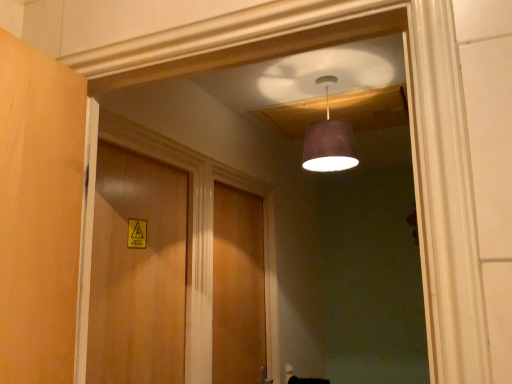
Question: Is wooden door at center, the 1th door viewed from the right, further to the viewer compared to wooden door at center, the 2th door in the right-to-left sequence?

Choices:
 (A) yes
 (B) no

Answer: (A)

Question: Does wooden door at center, which appears as the second door when viewed from the left, have a lesser height compared to wooden door at center, which is the 1th door in front-to-back order?

Choices:
 (A) no
 (B) yes

Answer: (A)

Question: From a real-world perspective, is wooden door at center, acting as the 1th door starting from the back, below wooden door at center, the 2th door from the back?

Choices:
 (A) no
 (B) yes

Answer: (B)

Question: From the image's perspective, does wooden door at center, which appears as the second door when viewed from the left, appear lower than wooden door at center, the first door from the left?

Choices:
 (A) no
 (B) yes

Answer: (B)

Question: Considering the relative positions of wooden door at center, the 2th door in the front-to-back sequence, and wooden door at center, the first door from the left, in the image provided, is wooden door at center, the 2th door in the front-to-back sequence, to the right of wooden door at center, the first door from the left, from the viewer's perspective?

Choices:
 (A) no
 (B) yes

Answer: (B)

Question: Is wooden door at center, which appears as the second door when viewed from the left, surrounding wooden door at center, the 2th door from the back?

Choices:
 (A) yes
 (B) no

Answer: (B)

Question: Can you confirm if wooden door at center, the 2th door in the right-to-left sequence, is shorter than wooden door at center, which appears as the second door when viewed from the left?

Choices:
 (A) yes
 (B) no

Answer: (A)

Question: Is wooden door at center, the 2th door from the back, turned away from wooden door at center, the 2th door in the front-to-back sequence?

Choices:
 (A) yes
 (B) no

Answer: (B)

Question: From a real-world perspective, is wooden door at center, the 2th door from the back, located beneath wooden door at center, acting as the 1th door starting from the back?

Choices:
 (A) no
 (B) yes

Answer: (A)

Question: Is wooden door at center, the first door from the left, positioned in front of wooden door at center, acting as the 1th door starting from the back?

Choices:
 (A) no
 (B) yes

Answer: (B)

Question: Is wooden door at center, the first door from the left, to the right of wooden door at center, the 2th door in the front-to-back sequence, from the viewer's perspective?

Choices:
 (A) yes
 (B) no

Answer: (B)

Question: Is wooden door at center, the first door from the left, thinner than wooden door at center, the 2th door in the front-to-back sequence?

Choices:
 (A) yes
 (B) no

Answer: (A)

Question: Is wooden door at center, the 2th door from the back, bigger than matte purple lampshade at upper center?

Choices:
 (A) no
 (B) yes

Answer: (B)